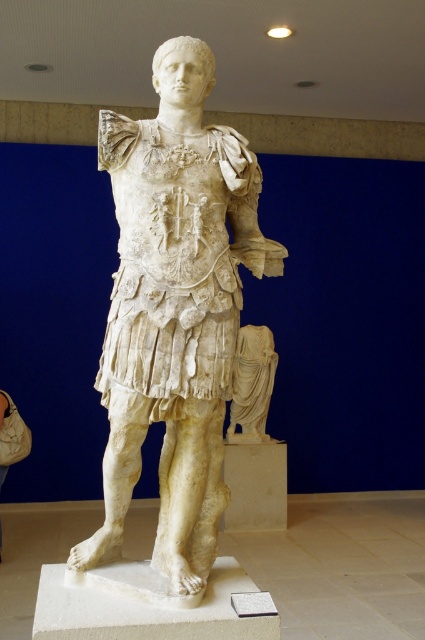
You are a museum curator planning to install a protective glass case around the white marble statue at center and the white marble draped cloth at center. To ensure the case covers both items adequately, which object should the case be placed over first?

The protective glass case should first be placed over the white marble draped cloth at center because the white marble statue at center is positioned over it, so placing the case over the cloth first will ensure the statue is also covered.

You are a museum visitor standing in front of the white marble statue at center and the white marble draped cloth at center. Which object is positioned to the left?

The white marble statue at center is positioned to the left of the white marble draped cloth at center.